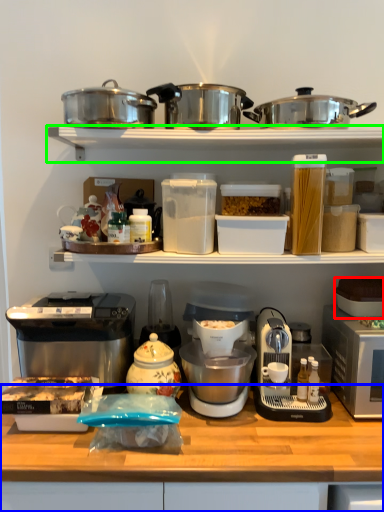
Question: Based on their relative distances, which object is nearer to appliance (highlighted by a red box)? Choose from table (highlighted by a blue box) and shelf (highlighted by a green box).

Choices:
 (A) table
 (B) shelf

Answer: (A)